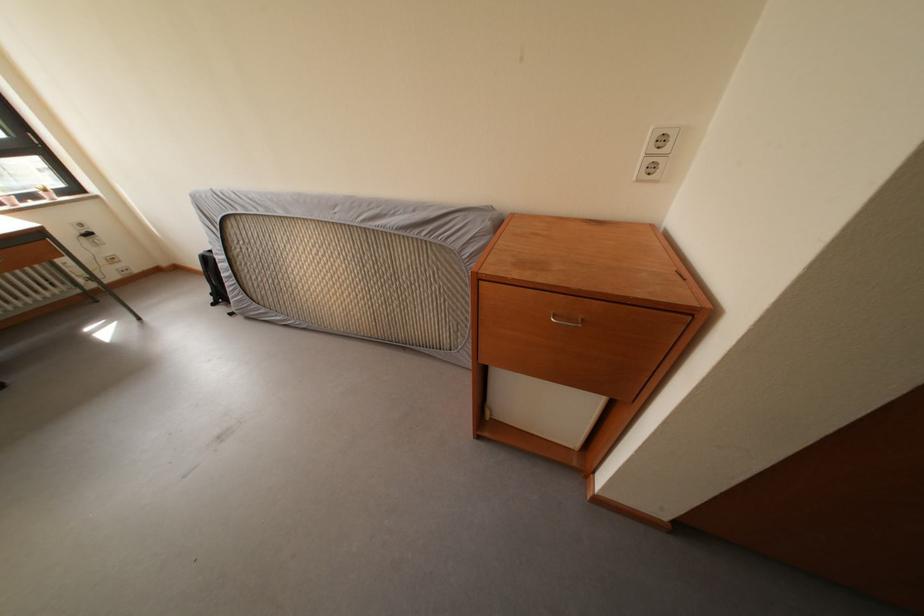
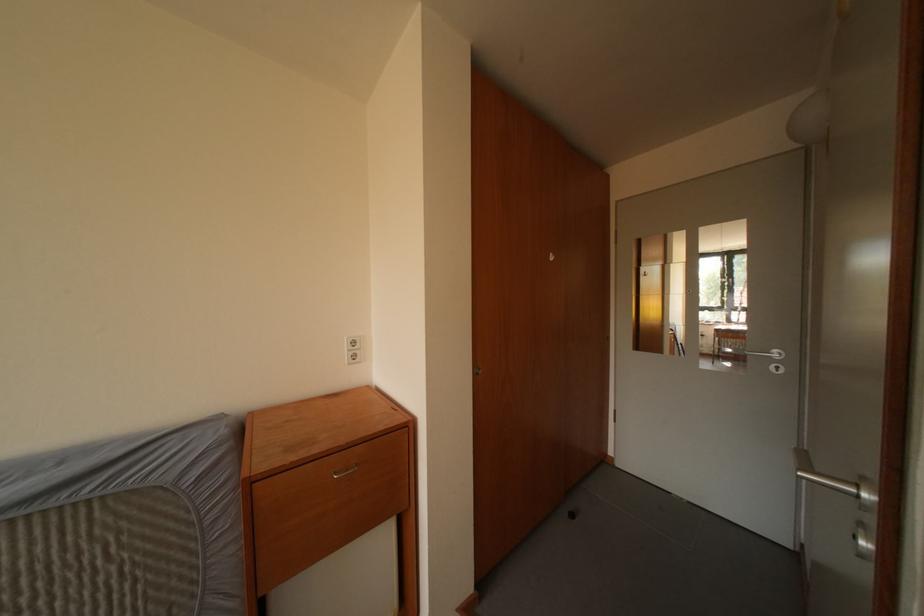
Looking at this image, how did the camera likely rotate?

The camera rotated toward right-up.